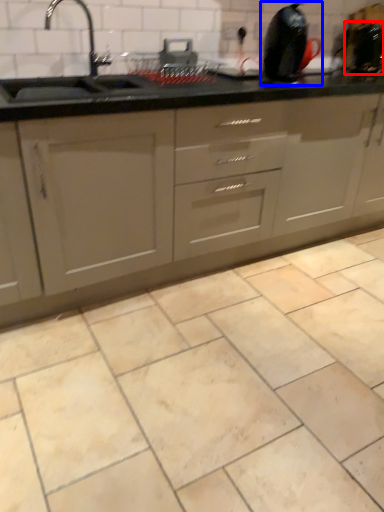
Question: Which of the following is the farthest to the observer, appliance (highlighted by a red box) or appliance (highlighted by a blue box)?

Choices:
 (A) appliance
 (B) appliance

Answer: (A)